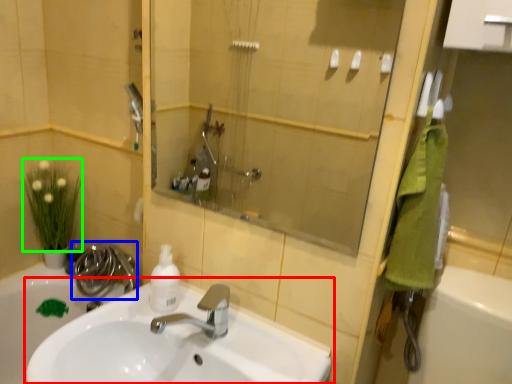
Question: Based on their relative distances, which object is farther from sink (highlighted by a red box)? Choose from plumbing fixture (highlighted by a blue box) and flower (highlighted by a green box).

Choices:
 (A) plumbing fixture
 (B) flower

Answer: (B)